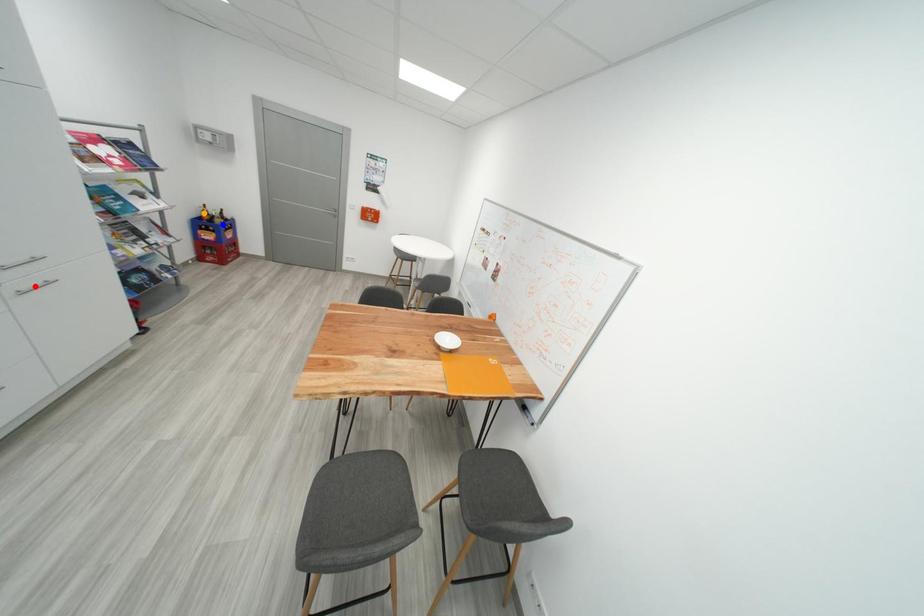
Order these from nearest to farthest:
- blue point
- orange point
- red point

red point < orange point < blue point